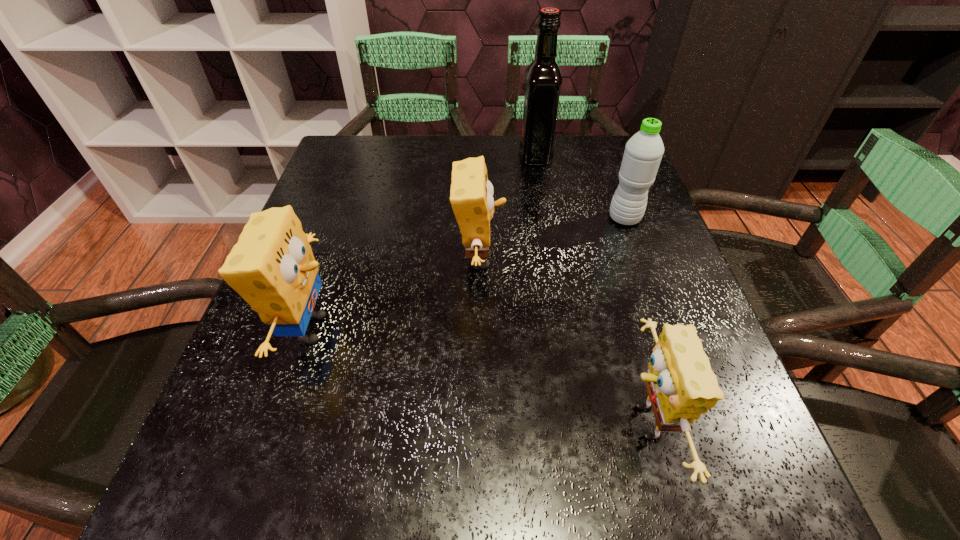
Where is `sponge that is the second closest to the second sponge from right to left`? The image size is (960, 540). sponge that is the second closest to the second sponge from right to left is located at coordinates (681, 386).

You are a GUI agent. You are given a task and a screenshot of the screen. Output one action in this format:
    pyautogui.click(x=<x>, y=<y>)
    Task: Click on the blank space that satisfies the following two spatial constraints: 1. on the front-facing side of the water bottle; 2. on the right side of the third object from left to right
    This screenshot has width=960, height=540.
    Given the screenshot: What is the action you would take?
    tap(546, 219)

The image size is (960, 540). Identify the location of free space that satisfies the following two spatial constraints: 1. on the front-facing side of the liquor; 2. on the back side of the water bottle. (546, 219).

Where is `free space that satisfies the following two spatial constraints: 1. on the front-facing side of the third object from left to right; 2. on the back side of the rightmost object`? free space that satisfies the following two spatial constraints: 1. on the front-facing side of the third object from left to right; 2. on the back side of the rightmost object is located at coordinates (546, 219).